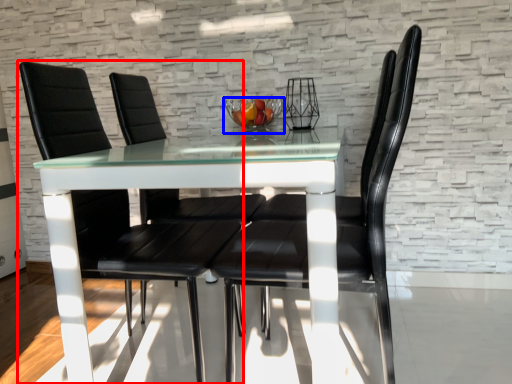
Question: Which of the following is the farthest to the observer, chair (highlighted by a red box) or glass bowl (highlighted by a blue box)?

Choices:
 (A) chair
 (B) glass bowl

Answer: (B)